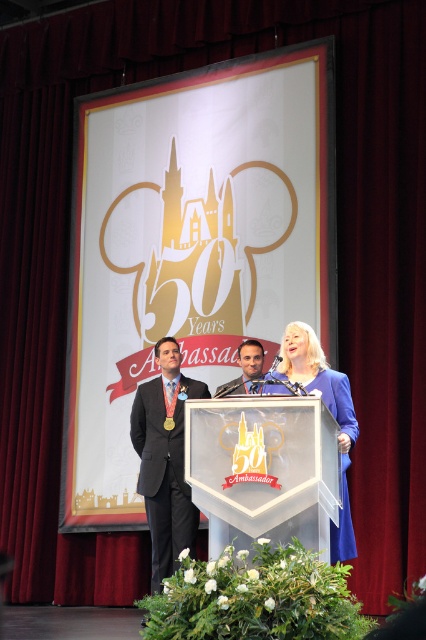
You are a photographer positioned at the camera. You need to capture a clear photo of the matte black suit at left. Given that the camera has a maximum focus range of 15 meters, will you be able to take a clear photo?

The matte black suit at left and camera are 15.37 meters apart from each other. Since the maximum focus range is 15 meters, the distance exceeds this limit by 0.37 meters. Therefore, the camera cannot focus clearly on the matte black suit at left.

You are attending the 50th anniversary celebration and notice two points marked in the scene. Which point is closer to you, point (x=245, y=348) or point (x=216, y=388)?

Point (x=245, y=348) is closer to the viewer than point (x=216, y=388).